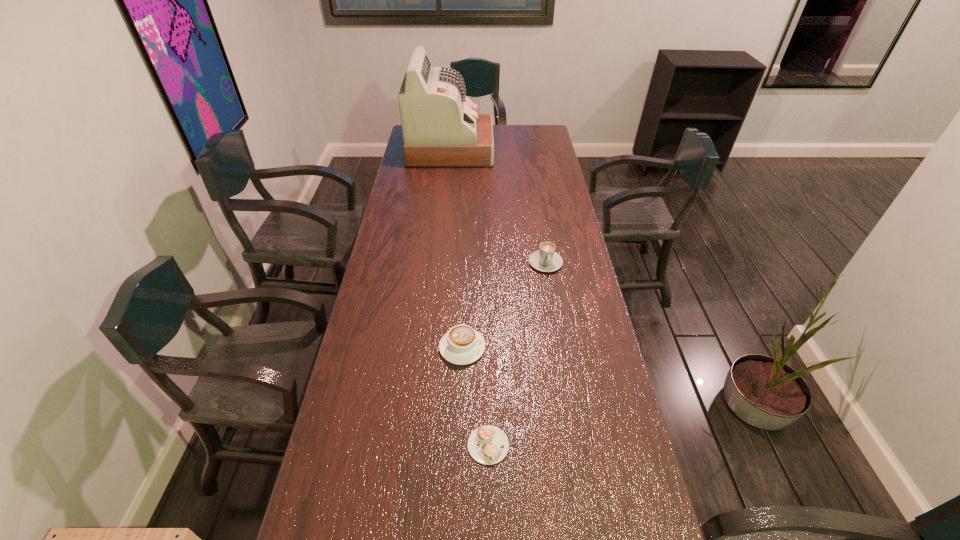
Image resolution: width=960 pixels, height=540 pixels. Identify the location of cash register. (441, 129).

Find the location of a particular element. the tallest object is located at coordinates (441, 129).

The image size is (960, 540). In order to click on the rightmost cappuccino in this screenshot , I will do `click(546, 259)`.

The height and width of the screenshot is (540, 960). I want to click on the rightmost object, so click(x=546, y=259).

This screenshot has width=960, height=540. I want to click on the third farthest object, so click(461, 345).

Find the location of a particular element. Image resolution: width=960 pixels, height=540 pixels. the second tallest cappuccino is located at coordinates (461, 345).

This screenshot has width=960, height=540. Find the location of `the nearest object`. the nearest object is located at coordinates (487, 444).

Where is `the nearest cappuccino`? the nearest cappuccino is located at coordinates (487, 444).

I want to click on free spot located on the operating side of the tallest object, so pos(504,151).

The height and width of the screenshot is (540, 960). What are the coordinates of `vacant space located to the right of the second tallest object` in the screenshot? It's located at (559, 344).